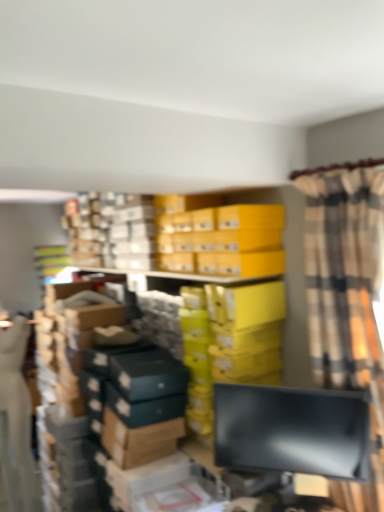
Measure the distance between point [335,265] and camera.

The distance of point [335,265] from camera is 1.79 meters.

Where is `plaid fabric curtain at right`? plaid fabric curtain at right is located at coordinates (347, 296).

Between plaid fabric curtain at right and yellow cardboard boxes at upper center, which one is positioned behind?

yellow cardboard boxes at upper center.

Does plaid fabric curtain at right have a smaller size compared to yellow cardboard boxes at upper center?

No.

The image size is (384, 512). There is a plaid fabric curtain at right. Identify the location of bookcase above it (from a real-world perspective). (183, 236).

Is plaid fabric curtain at right inside the boundaries of yellow cardboard boxes at upper center, or outside?

plaid fabric curtain at right is spatially situated outside yellow cardboard boxes at upper center.

Between plaid fabric curtain at right and matte black monitor at lower right, which one has larger width?

With larger width is plaid fabric curtain at right.

Which is in front, plaid fabric curtain at right or matte black monitor at lower right?

plaid fabric curtain at right is closer to the camera.

Between point (371, 254) and point (304, 451), which one is positioned behind?

The point (304, 451) is behind.

How different are the orientations of yellow cardboard boxes at upper center and plaid fabric curtain at right in degrees?

yellow cardboard boxes at upper center and plaid fabric curtain at right are facing 5.69 degrees away from each other.

Is yellow cardboard boxes at upper center to the left or to the right of plaid fabric curtain at right in the image?

yellow cardboard boxes at upper center is positioned on plaid fabric curtain at right's left side.

Are yellow cardboard boxes at upper center and plaid fabric curtain at right beside each other?

yellow cardboard boxes at upper center and plaid fabric curtain at right are not in contact.

From a real-world perspective, is yellow cardboard boxes at upper center above or below plaid fabric curtain at right?

Clearly, from a real-world perspective, yellow cardboard boxes at upper center is above plaid fabric curtain at right.

Between point (251, 429) and point (341, 263), which one is positioned in front?

The point (341, 263) is closer.

Is matte black monitor at lower right oriented towards plaid fabric curtain at right?

No, matte black monitor at lower right does not turn towards plaid fabric curtain at right.

Based on the photo, from their relative heights in the image, would you say matte black monitor at lower right is taller or shorter than plaid fabric curtain at right?

matte black monitor at lower right is shorter than plaid fabric curtain at right.

Is matte black monitor at lower right bigger or smaller than plaid fabric curtain at right?

matte black monitor at lower right is smaller than plaid fabric curtain at right.

Who is smaller, matte black monitor at lower right or yellow cardboard boxes at upper center?

matte black monitor at lower right is smaller.

Is matte black monitor at lower right next to yellow cardboard boxes at upper center?

No.

Does point (219, 430) come behind point (188, 249)?

No.

From the image's perspective, is matte black monitor at lower right located above or below yellow cardboard boxes at upper center?

matte black monitor at lower right is below yellow cardboard boxes at upper center.

Does yellow cardboard boxes at upper center come in front of matte black monitor at lower right?

No, the depth of yellow cardboard boxes at upper center is greater than that of matte black monitor at lower right.

In terms of size, does yellow cardboard boxes at upper center appear bigger or smaller than matte black monitor at lower right?

yellow cardboard boxes at upper center is bigger than matte black monitor at lower right.

Considering the points (194, 259) and (322, 416), which point is behind, point (194, 259) or point (322, 416)?

Point (194, 259)

Where is `bookcase on the left of matte black monitor at lower right`? The image size is (384, 512). bookcase on the left of matte black monitor at lower right is located at coordinates (183, 236).

This screenshot has height=512, width=384. I want to click on bookcase behind the plaid fabric curtain at right, so click(x=183, y=236).

This screenshot has height=512, width=384. What are the coordinates of `computer monitor below the plaid fabric curtain at right (from the image's perspective)` in the screenshot? It's located at (292, 431).

Which object lies further to the anchor point plaid fabric curtain at right, yellow cardboard boxes at upper center or matte black monitor at lower right?

yellow cardboard boxes at upper center lies further to plaid fabric curtain at right than the other object.

Looking at the image, which one is located closer to plaid fabric curtain at right, matte black monitor at lower right or yellow cardboard boxes at upper center?

matte black monitor at lower right is closer to plaid fabric curtain at right.

Based on their spatial positions, is yellow cardboard boxes at upper center or plaid fabric curtain at right closer to matte black monitor at lower right?

plaid fabric curtain at right is positioned closer to the anchor matte black monitor at lower right.

Based on their spatial positions, is plaid fabric curtain at right or matte black monitor at lower right further from yellow cardboard boxes at upper center?

matte black monitor at lower right is positioned further to the anchor yellow cardboard boxes at upper center.

When comparing their distances from yellow cardboard boxes at upper center, does matte black monitor at lower right or plaid fabric curtain at right seem closer?

Based on the image, plaid fabric curtain at right appears to be nearer to yellow cardboard boxes at upper center.

Looking at the image, which one is located closer to matte black monitor at lower right, plaid fabric curtain at right or yellow cardboard boxes at upper center?

plaid fabric curtain at right is positioned closer to the anchor matte black monitor at lower right.

Where is `curtain between yellow cardboard boxes at upper center and matte black monitor at lower right in the up-down direction`? The width and height of the screenshot is (384, 512). curtain between yellow cardboard boxes at upper center and matte black monitor at lower right in the up-down direction is located at coordinates (347, 296).